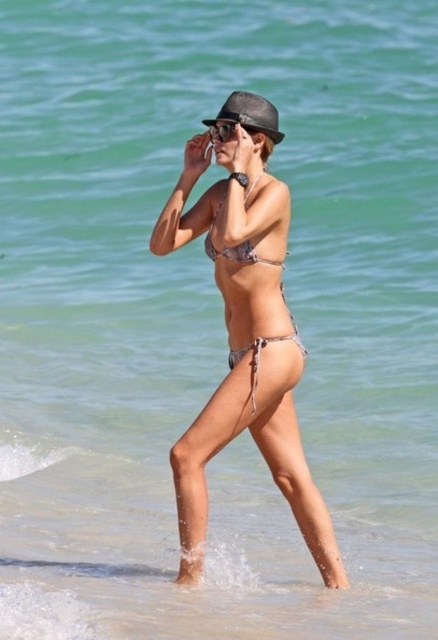
Question: Which is farther from the black matte sunglasses at center?

Choices:
 (A) printed fabric bikini at center
 (B) black leather fedora at center
 (C) printed fabric bikini top at center

Answer: (A)

Question: Is black leather fedora at center to the right of printed fabric bikini top at center from the viewer's perspective?

Choices:
 (A) no
 (B) yes

Answer: (B)

Question: In this image, where is black leather fedora at center located relative to black matte sunglasses at center?

Choices:
 (A) right
 (B) left

Answer: (A)

Question: Is metallic silver bikini at center wider than black matte sunglasses at center?

Choices:
 (A) yes
 (B) no

Answer: (A)

Question: Estimate the real-world distances between objects in this image. Which object is farther from the metallic silver bikini at center?

Choices:
 (A) printed fabric bikini at center
 (B) black leather fedora at center
 (C) printed fabric bikini top at center
 (D) black matte sunglasses at center

Answer: (D)

Question: Which object is farther from the camera taking this photo?

Choices:
 (A) printed fabric bikini top at center
 (B) printed fabric bikini at center
 (C) black matte sunglasses at center

Answer: (C)